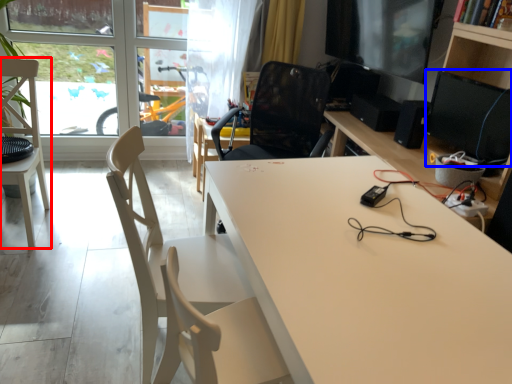
Question: Among these objects, which one is farthest to the camera, chair (highlighted by a red box) or computer monitor (highlighted by a blue box)?

Choices:
 (A) chair
 (B) computer monitor

Answer: (A)